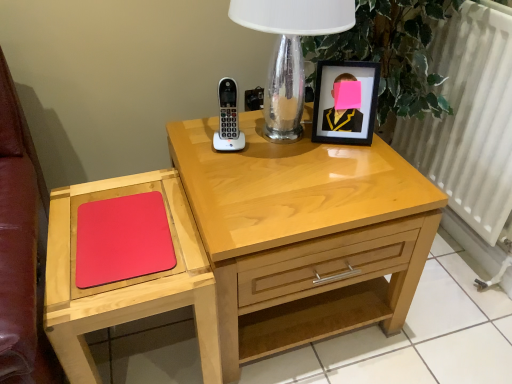
The width and height of the screenshot is (512, 384). I want to click on vacant region in front of white plastic phone at center, so click(x=234, y=176).